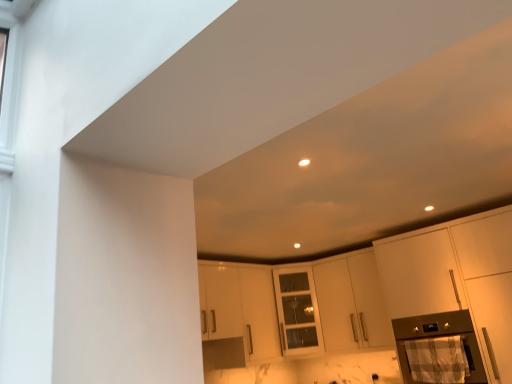
What is the approximate height of white matte cabinet at center, the first cabinetry in the back-to-front sequence?

35.29 inches.

This screenshot has height=384, width=512. Find the location of `metallic stainless steel oven at lower right`. metallic stainless steel oven at lower right is located at coordinates (428, 332).

Looking at this image, from a real-world perspective, is white matte cabinet at center, positioned as the second cabinetry in front-to-back order, above or below matte white cabinet at right, which is the second cabinetry in back-to-front order?

From a real-world perspective, white matte cabinet at center, positioned as the second cabinetry in front-to-back order, is physically above matte white cabinet at right, which is the second cabinetry in back-to-front order.

Does point (325, 335) appear closer or farther from the camera than point (477, 297)?

Point (325, 335) is positioned farther from the camera compared to point (477, 297).

Does white matte cabinet at center, the first cabinetry in the back-to-front sequence, touch matte white cabinet at right, which is the second cabinetry in back-to-front order?

white matte cabinet at center, the first cabinetry in the back-to-front sequence, and matte white cabinet at right, which is the second cabinetry in back-to-front order, are not in contact.

Is white matte cabinet at center, the first cabinetry in the back-to-front sequence, not within matte white cabinet at right, arranged as the 1th cabinetry when viewed from the front?

Yes, white matte cabinet at center, the first cabinetry in the back-to-front sequence, is located beyond the bounds of matte white cabinet at right, arranged as the 1th cabinetry when viewed from the front.

Is the surface of metallic stainless steel oven at lower right in direct contact with white matte cabinet at center, positioned as the second cabinetry in front-to-back order?

metallic stainless steel oven at lower right and white matte cabinet at center, positioned as the second cabinetry in front-to-back order, are not in contact.

Between metallic stainless steel oven at lower right and white matte cabinet at center, positioned as the second cabinetry in front-to-back order, which one appears on the left side from the viewer's perspective?

white matte cabinet at center, positioned as the second cabinetry in front-to-back order, is more to the left.

Is metallic stainless steel oven at lower right facing away from white matte cabinet at center, positioned as the second cabinetry in front-to-back order?

That's not correct — metallic stainless steel oven at lower right is not looking away from white matte cabinet at center, positioned as the second cabinetry in front-to-back order.

Does matte white cabinet at right, arranged as the 1th cabinetry when viewed from the front, have a smaller size compared to metallic stainless steel oven at lower right?

Actually, matte white cabinet at right, arranged as the 1th cabinetry when viewed from the front, might be larger than metallic stainless steel oven at lower right.

Based on the photo, is matte white cabinet at right, which is the second cabinetry in back-to-front order, at the right side of metallic stainless steel oven at lower right?

Yes, matte white cabinet at right, which is the second cabinetry in back-to-front order, is to the right of metallic stainless steel oven at lower right.

In the scene shown: From the image's perspective, relative to metallic stainless steel oven at lower right, is matte white cabinet at right, arranged as the 1th cabinetry when viewed from the front, above or below?

matte white cabinet at right, arranged as the 1th cabinetry when viewed from the front, is situated higher than metallic stainless steel oven at lower right in the image.

Considering the positions of point (508, 373) and point (439, 324), is point (508, 373) closer or farther from the camera than point (439, 324)?

Point (508, 373) appears to be closer to the viewer than point (439, 324).

Considering the points (499, 379) and (385, 325), which point is behind, point (499, 379) or point (385, 325)?

Point (385, 325)

Can you see matte white cabinet at right, which is the second cabinetry in back-to-front order, touching white matte cabinet at center, the first cabinetry in the back-to-front sequence?

No, matte white cabinet at right, which is the second cabinetry in back-to-front order, is not touching white matte cabinet at center, the first cabinetry in the back-to-front sequence.

Image resolution: width=512 pixels, height=384 pixels. In order to click on cabinetry on the right of white matte cabinet at center, positioned as the second cabinetry in front-to-back order in this screenshot , I will do `click(456, 277)`.

Could you tell me if matte white cabinet at right, which is the second cabinetry in back-to-front order, is facing white matte cabinet at center, the first cabinetry in the back-to-front sequence?

No, matte white cabinet at right, which is the second cabinetry in back-to-front order, is not aimed at white matte cabinet at center, the first cabinetry in the back-to-front sequence.

Which is nearer, (x=360, y=342) or (x=434, y=329)?

Point (x=360, y=342) is farther from the camera than point (x=434, y=329).

From the image's perspective, which is below, white matte cabinet at center, the first cabinetry in the back-to-front sequence, or metallic stainless steel oven at lower right?

From the image's view, metallic stainless steel oven at lower right is below.

Which of these two, white matte cabinet at center, the first cabinetry in the back-to-front sequence, or metallic stainless steel oven at lower right, is bigger?

white matte cabinet at center, the first cabinetry in the back-to-front sequence.

Could you measure the distance between white matte cabinet at center, positioned as the second cabinetry in front-to-back order, and metallic stainless steel oven at lower right?

The distance of white matte cabinet at center, positioned as the second cabinetry in front-to-back order, from metallic stainless steel oven at lower right is 23.44 inches.

In the image, is metallic stainless steel oven at lower right positioned in front of or behind matte white cabinet at right, which is the second cabinetry in back-to-front order?

metallic stainless steel oven at lower right is behind matte white cabinet at right, which is the second cabinetry in back-to-front order.

Which is nearer, (410, 319) or (504, 288)?

Point (410, 319) is farther from the camera than point (504, 288).

Locate an element on the screen. appliance located below the matte white cabinet at right, which is the second cabinetry in back-to-front order (from the image's perspective) is located at coordinates (428, 332).

You are a GUI agent. You are given a task and a screenshot of the screen. Output one action in this format:
    pyautogui.click(x=<x>, y=<y>)
    Task: Click on the cabinetry below the matte white cabinet at right, arranged as the 1th cabinetry when viewed from the front (from the image's perspective)
    The height and width of the screenshot is (384, 512).
    Given the screenshot: What is the action you would take?
    pyautogui.click(x=352, y=303)

At what (x,y) coordinates should I click in order to perform the action: click on cabinetry that is the 1st object located above the metallic stainless steel oven at lower right (from the image's perspective). Please return your answer as a coordinate pair (x, y). Looking at the image, I should click on (352, 303).

Considering their positions, is white matte cabinet at center, positioned as the second cabinetry in front-to-back order, positioned further to metallic stainless steel oven at lower right than matte white cabinet at right, which is the second cabinetry in back-to-front order?

white matte cabinet at center, positioned as the second cabinetry in front-to-back order, lies further to metallic stainless steel oven at lower right than the other object.

Looking at the image, which one is located closer to white matte cabinet at center, positioned as the second cabinetry in front-to-back order, matte white cabinet at right, arranged as the 1th cabinetry when viewed from the front, or metallic stainless steel oven at lower right?

metallic stainless steel oven at lower right.

Which object lies further to the anchor point matte white cabinet at right, arranged as the 1th cabinetry when viewed from the front, metallic stainless steel oven at lower right or white matte cabinet at center, the first cabinetry in the back-to-front sequence?

Based on the image, white matte cabinet at center, the first cabinetry in the back-to-front sequence, appears to be further to matte white cabinet at right, arranged as the 1th cabinetry when viewed from the front.

Which object lies further to the anchor point matte white cabinet at right, which is the second cabinetry in back-to-front order, white matte cabinet at center, positioned as the second cabinetry in front-to-back order, or metallic stainless steel oven at lower right?

white matte cabinet at center, positioned as the second cabinetry in front-to-back order.

Considering their positions, is matte white cabinet at right, which is the second cabinetry in back-to-front order, positioned further to metallic stainless steel oven at lower right than white matte cabinet at center, positioned as the second cabinetry in front-to-back order?

Based on the image, white matte cabinet at center, positioned as the second cabinetry in front-to-back order, appears to be further to metallic stainless steel oven at lower right.

Estimate the real-world distances between objects in this image. Which object is closer to white matte cabinet at center, the first cabinetry in the back-to-front sequence, metallic stainless steel oven at lower right or matte white cabinet at right, arranged as the 1th cabinetry when viewed from the front?

metallic stainless steel oven at lower right is positioned closer to the anchor white matte cabinet at center, the first cabinetry in the back-to-front sequence.

You are a GUI agent. You are given a task and a screenshot of the screen. Output one action in this format:
    pyautogui.click(x=<x>, y=<y>)
    Task: Click on the appliance between matte white cabinet at right, arranged as the 1th cabinetry when viewed from the front, and white matte cabinet at center, the first cabinetry in the back-to-front sequence, along the z-axis
    
    Given the screenshot: What is the action you would take?
    pyautogui.click(x=428, y=332)